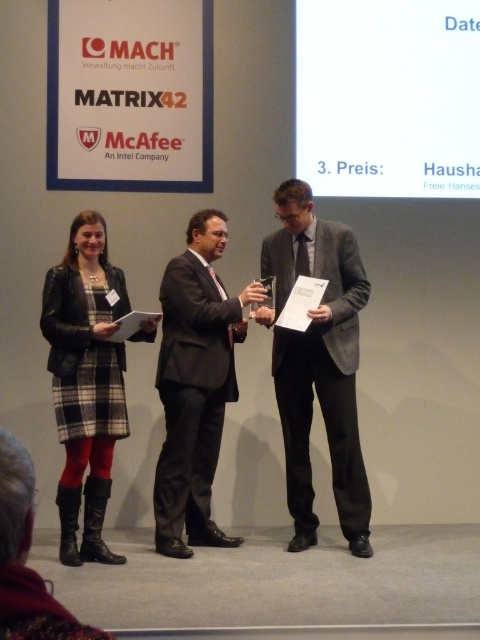
Looking at this image, based on the scene description, which object is positioned higher relative to the other? Please refer to the spatial arrangement of the black suit at center and plaid fabric dress at left.

The black suit at center is positioned higher than the plaid fabric dress at left according to the spatial description provided.

You are a photographer positioned at the back of the stage. You want to take a photo of both the gray suit at center and the plaid fabric dress at left. However, you notice that one of them might be blocking the other. Which one is more likely to be in front and visible in the photo?

The gray suit at center is further to the viewer than the plaid fabric dress at left, so the gray suit at center will be in front and more visible in the photo.

You are an event photographer at the award ceremony. You need to capture a photo that clearly shows both the gray suit at center and the plaid fabric dress at left. Based on their positions, which one should you focus on first to ensure both are in frame?

The gray suit at center is positioned over the plaid fabric dress at left, so focusing on the gray suit at center first will ensure both are in frame as the plaid fabric dress at left is behind it.